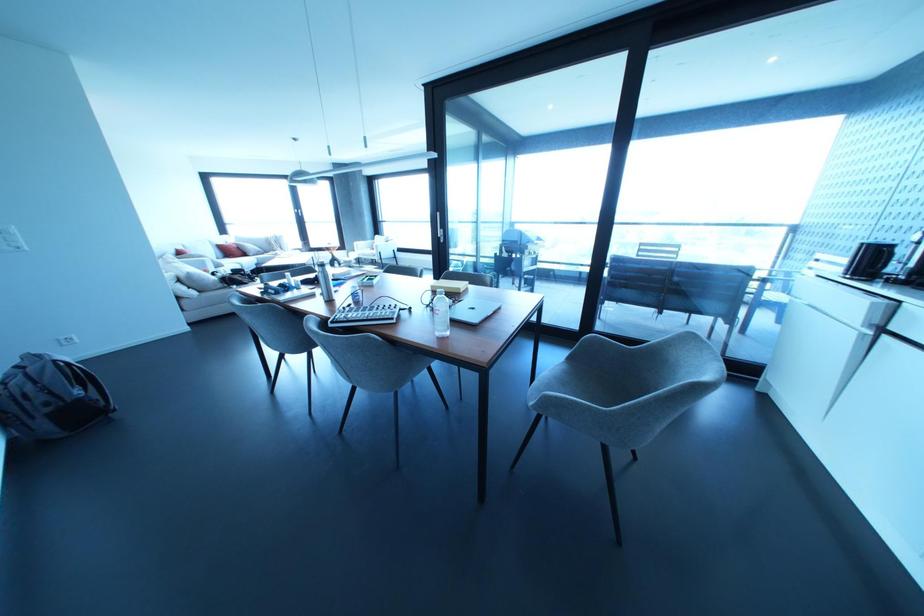
Identify the location of grey chair armrest. (579, 400).